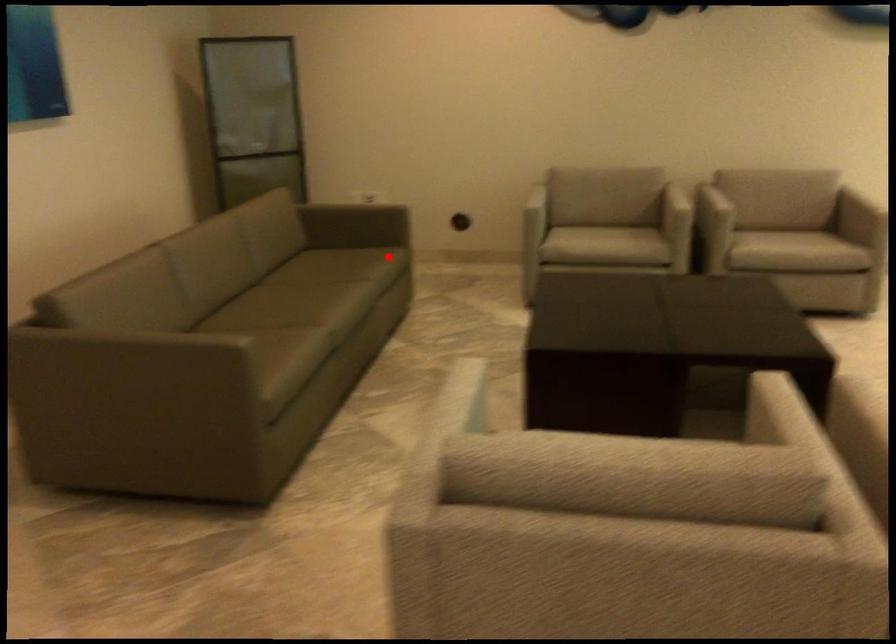
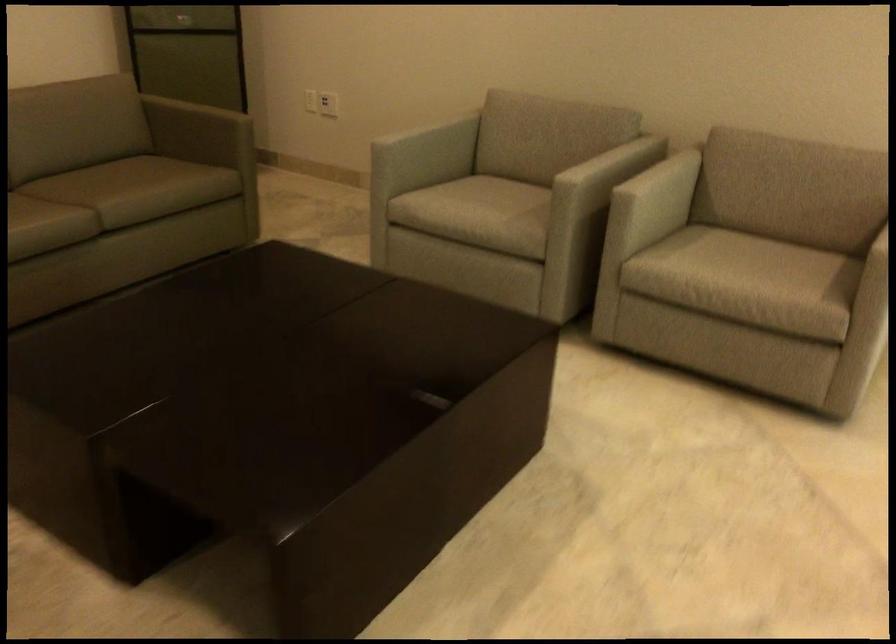
In the second image, find the point that corresponds to the highlighted location in the first image.

(145, 187)